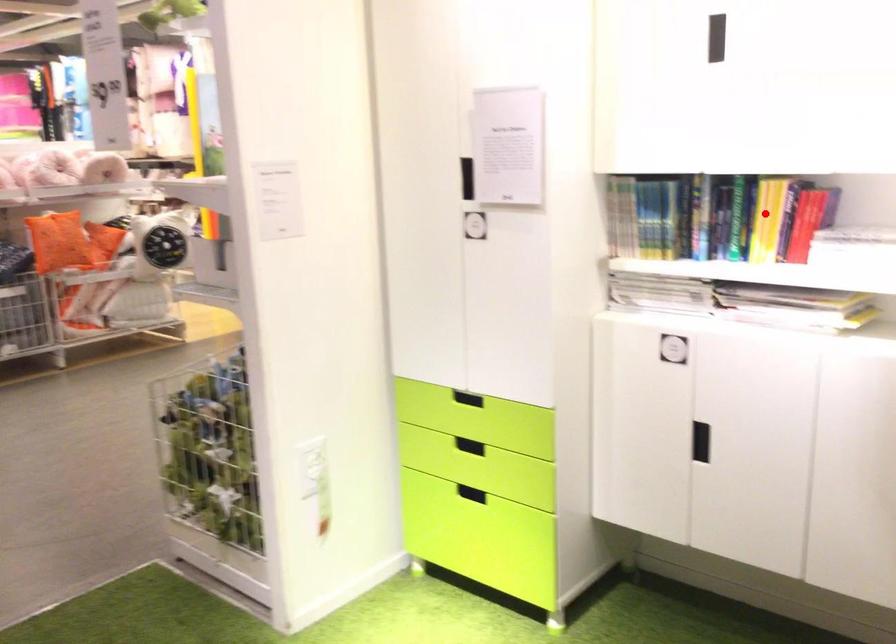
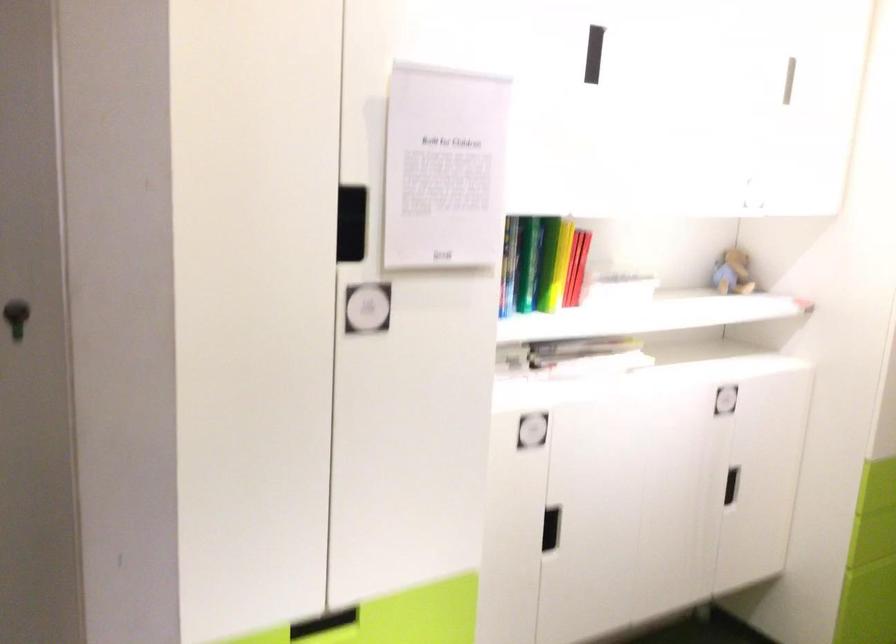
In the second image, find the point that corresponds to the highlighted location in the first image.

(561, 263)